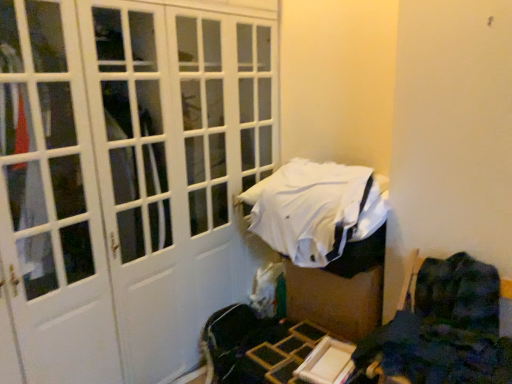
Question: Is white fabric bed at center not inside dark blue fabric chair at lower right?

Choices:
 (A) no
 (B) yes

Answer: (B)

Question: From the image's perspective, is white fabric bed at center over dark blue fabric chair at lower right?

Choices:
 (A) no
 (B) yes

Answer: (B)

Question: Is dark blue fabric chair at lower right located within white fabric bed at center?

Choices:
 (A) yes
 (B) no

Answer: (B)

Question: Is the position of white fabric bed at center more distant than that of dark blue fabric chair at lower right?

Choices:
 (A) no
 (B) yes

Answer: (B)

Question: Is white fabric bed at center oriented away from dark blue fabric chair at lower right?

Choices:
 (A) no
 (B) yes

Answer: (A)

Question: Relative to white fabric bed at center, is dark blue fabric chair at lower right in front or behind?

Choices:
 (A) behind
 (B) front

Answer: (B)

Question: Considering the positions of dark blue fabric chair at lower right and white fabric bed at center in the image, is dark blue fabric chair at lower right taller or shorter than white fabric bed at center?

Choices:
 (A) short
 (B) tall

Answer: (B)

Question: From the image's perspective, relative to white fabric bed at center, is dark blue fabric chair at lower right above or below?

Choices:
 (A) below
 (B) above

Answer: (A)

Question: In the image, is dark blue fabric chair at lower right on the left side or the right side of white fabric bed at center?

Choices:
 (A) left
 (B) right

Answer: (B)

Question: In terms of size, does white matte door at center appear bigger or smaller than white fabric bed at center?

Choices:
 (A) big
 (B) small

Answer: (A)

Question: Considering the positions of white matte door at center and white fabric bed at center in the image, is white matte door at center taller or shorter than white fabric bed at center?

Choices:
 (A) tall
 (B) short

Answer: (A)

Question: Does point (83, 163) appear closer or farther from the camera than point (279, 203)?

Choices:
 (A) farther
 (B) closer

Answer: (B)

Question: From a real-world perspective, is white matte door at center positioned above or below white fabric bed at center?

Choices:
 (A) below
 (B) above

Answer: (B)

Question: Would you say dark blue fabric chair at lower right is to the left or to the right of white matte door at center in the picture?

Choices:
 (A) right
 (B) left

Answer: (A)

Question: From a real-world perspective, is dark blue fabric chair at lower right positioned above or below white matte door at center?

Choices:
 (A) below
 (B) above

Answer: (A)